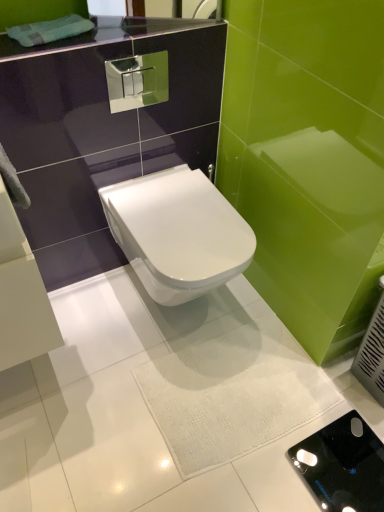
Identify the location of vacant area on the back side of black glossy porcelain at center. (319, 392).